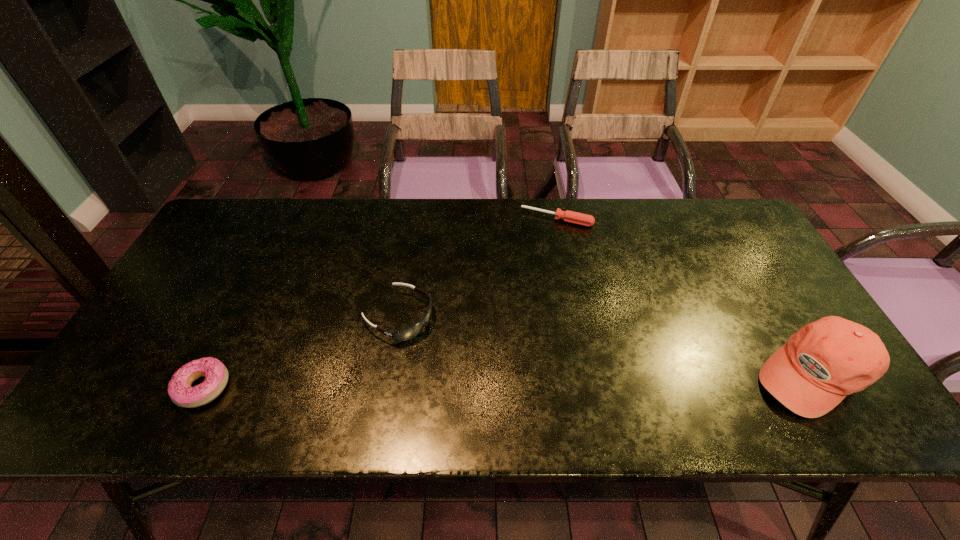
This screenshot has width=960, height=540. Find the location of `vacant point located between the doughnut and the shortest object`. vacant point located between the doughnut and the shortest object is located at coordinates (380, 303).

The image size is (960, 540). Find the location of `vacant space that's between the third object from right to left and the leftmost object`. vacant space that's between the third object from right to left and the leftmost object is located at coordinates (300, 352).

What are the coordinates of `free spot between the shortest object and the third tallest object` in the screenshot? It's located at (380, 303).

The width and height of the screenshot is (960, 540). I want to click on vacant area that lies between the shortest object and the second object from left to right, so click(x=477, y=268).

At what (x,y) coordinates should I click in order to perform the action: click on vacant area that lies between the baseball cap and the third tallest object. Please return your answer as a coordinate pair (x, y). The height and width of the screenshot is (540, 960). Looking at the image, I should click on (507, 380).

The width and height of the screenshot is (960, 540). Find the location of `free space between the second object from right to left and the tallest object`. free space between the second object from right to left and the tallest object is located at coordinates (684, 296).

Locate an element on the screen. This screenshot has height=540, width=960. object that can be found as the closest to the goggles is located at coordinates (180, 391).

Identify which object is the third closest to the tallest object. Please provide its 2D coordinates. Your answer should be formatted as a tuple, i.e. [(x, y)], where the tuple contains the x and y coordinates of a point satisfying the conditions above.

[(180, 391)]

Locate an element on the screen. The height and width of the screenshot is (540, 960). vacant area that satisfies the following two spatial constraints: 1. on the back side of the doughnut; 2. on the left side of the goggles is located at coordinates (238, 316).

Where is `vacant area that satisfies the following two spatial constraints: 1. on the back side of the screwdriver; 2. on the left side of the leftmost object`? vacant area that satisfies the following two spatial constraints: 1. on the back side of the screwdriver; 2. on the left side of the leftmost object is located at coordinates (285, 219).